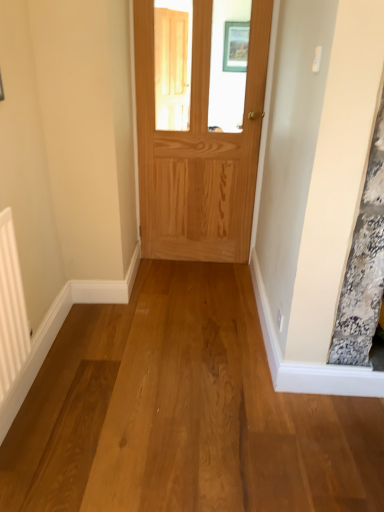
What do you see at coordinates (198, 150) in the screenshot? I see `natural wood door at center` at bounding box center [198, 150].

The width and height of the screenshot is (384, 512). I want to click on natural wood door at center, so click(198, 150).

Measure the distance between point (8,291) and camera.

The depth of point (8,291) is 4.84 feet.

Locate an element on the screen. Image resolution: width=384 pixels, height=512 pixels. white textured radiator at left is located at coordinates (11, 308).

The width and height of the screenshot is (384, 512). Describe the element at coordinates (11, 308) in the screenshot. I see `white textured radiator at left` at that location.

You are a GUI agent. You are given a task and a screenshot of the screen. Output one action in this format:
    pyautogui.click(x=<x>, y=<y>)
    Task: Click on the natural wood door at center
    Image resolution: width=384 pixels, height=512 pixels.
    Given the screenshot: What is the action you would take?
    pyautogui.click(x=198, y=150)

Between white textured radiator at left and natural wood door at center, which one appears on the left side from the viewer's perspective?

From the viewer's perspective, white textured radiator at left appears more on the left side.

Which is in front, white textured radiator at left or natural wood door at center?

white textured radiator at left is in front.

Which is in front, point (12, 246) or point (203, 98)?

Point (12, 246)

From the image's perspective, which is above, white textured radiator at left or natural wood door at center?

natural wood door at center appears higher in the image.

From a real-world perspective, is white textured radiator at left above or below natural wood door at center?

white textured radiator at left is below natural wood door at center.

From the picture: Between white textured radiator at left and natural wood door at center, which one has smaller width?

With smaller width is white textured radiator at left.

Can you confirm if white textured radiator at left is shorter than natural wood door at center?

Yes.

Does white textured radiator at left have a smaller size compared to natural wood door at center?

Yes, white textured radiator at left is smaller than natural wood door at center.

Do you think white textured radiator at left is within natural wood door at center, or outside of it?

white textured radiator at left lies outside natural wood door at center.

Is white textured radiator at left not close to natural wood door at center?

Yes, white textured radiator at left and natural wood door at center are located far from each other.

Could you tell me if white textured radiator at left is facing natural wood door at center?

No.

How far apart are white textured radiator at left and natural wood door at center?

white textured radiator at left and natural wood door at center are 1.51 meters apart.

Identify the location of radiator on the left of natural wood door at center. (11, 308).

Can you confirm if natural wood door at center is positioned to the right of white textured radiator at left?

Correct, you'll find natural wood door at center to the right of white textured radiator at left.

Does natural wood door at center come behind white textured radiator at left?

Yes.

Does point (223, 213) come behind point (12, 368)?

Yes.

From the image's perspective, does natural wood door at center appear lower than white textured radiator at left?

Incorrect, from the image's perspective, natural wood door at center is higher than white textured radiator at left.

From a real-world perspective, between natural wood door at center and white textured radiator at left, who is vertically lower?

white textured radiator at left.

Which object is wider, natural wood door at center or white textured radiator at left?

natural wood door at center is wider.

From the picture: Who is shorter, natural wood door at center or white textured radiator at left?

Standing shorter between the two is white textured radiator at left.

Based on the photo, which of these two, natural wood door at center or white textured radiator at left, is smaller?

With smaller size is white textured radiator at left.

Is white textured radiator at left surrounded by natural wood door at center?

No, white textured radiator at left is not surrounded by natural wood door at center.

Are natural wood door at center and white textured radiator at left far apart?

Yes, natural wood door at center is far from white textured radiator at left.

Could you tell me if natural wood door at center is facing white textured radiator at left?

Yes, natural wood door at center is turned towards white textured radiator at left.

What's the angular difference between natural wood door at center and white textured radiator at left's facing directions?

88.9 degrees.

Measure the distance between natural wood door at center and white textured radiator at left.

The distance of natural wood door at center from white textured radiator at left is 1.51 meters.

In order to click on radiator located on the left of natural wood door at center in this screenshot , I will do `click(11, 308)`.

The height and width of the screenshot is (512, 384). I want to click on door on the right side of white textured radiator at left, so click(198, 150).

Locate an element on the screen. radiator lying in front of the natural wood door at center is located at coordinates (11, 308).